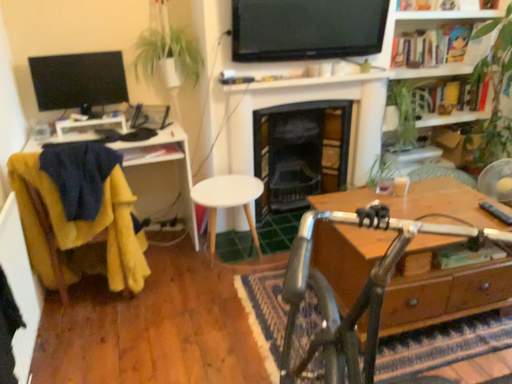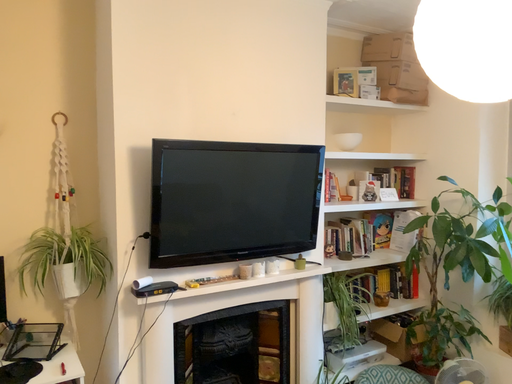
Question: Which way did the camera rotate in the video?

Choices:
 (A) rotated right
 (B) rotated left

Answer: (A)